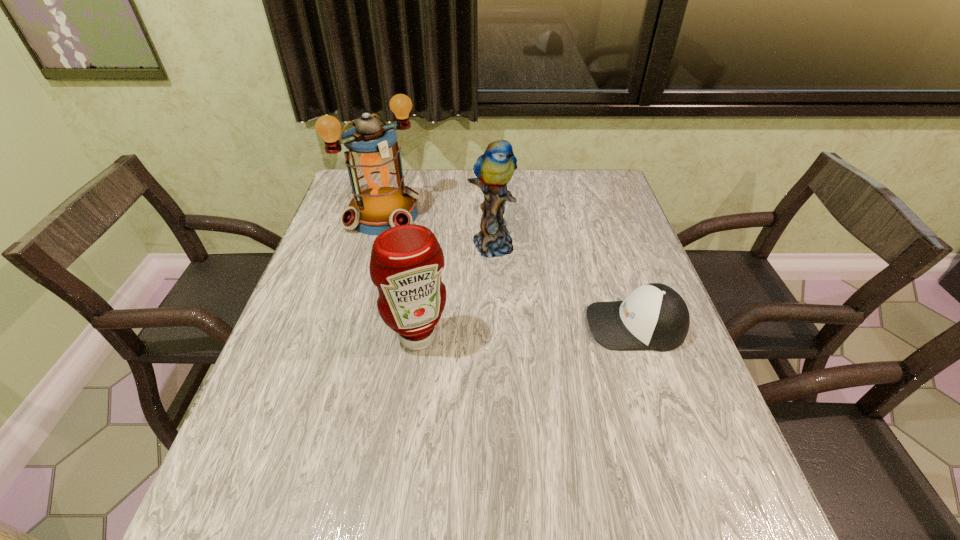
In the image, there is a desktop. What are the coordinates of `free space at the near edge` in the screenshot? It's located at (436, 429).

This screenshot has width=960, height=540. I want to click on vacant space at the left edge of the desktop, so click(348, 240).

Find the location of a particular element. The height and width of the screenshot is (540, 960). free space at the right edge is located at coordinates (603, 243).

What are the coordinates of `vacant space at the far right corner` in the screenshot? It's located at (609, 179).

Find the location of a particular element. This screenshot has height=540, width=960. vacant area that lies between the lantern and the third object from left to right is located at coordinates (438, 229).

Locate an element on the screen. The image size is (960, 540). vacant point located between the lantern and the shortest object is located at coordinates (510, 270).

The height and width of the screenshot is (540, 960). I want to click on vacant area that lies between the parrot and the rightmost object, so click(x=564, y=284).

Identify the location of unoccupied area between the rightmost object and the lantern. (510, 270).

The width and height of the screenshot is (960, 540). Find the location of `free point between the third object from left to right and the condiment`. free point between the third object from left to right and the condiment is located at coordinates (454, 290).

The width and height of the screenshot is (960, 540). I want to click on vacant space that is in between the lantern and the rightmost object, so click(510, 270).